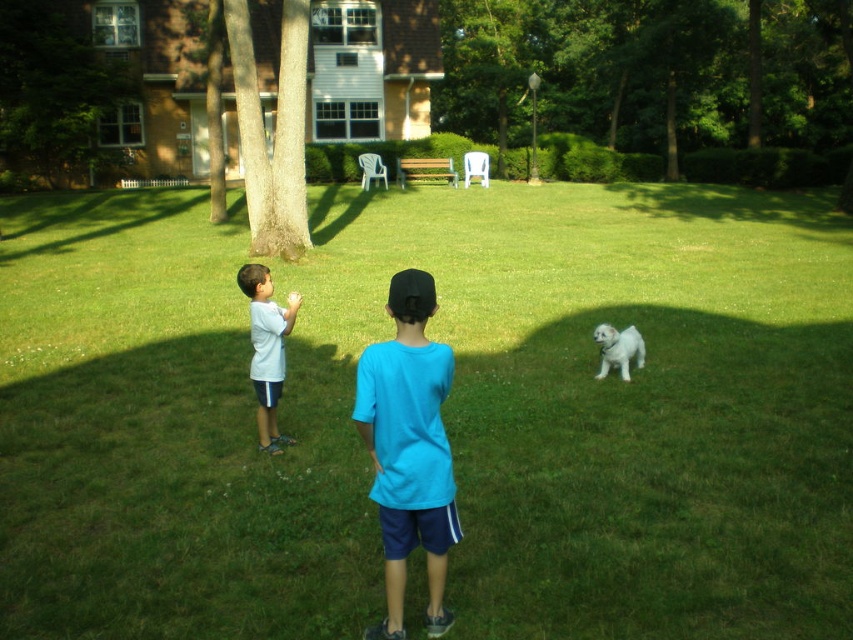
You are a photographer trying to capture a photo of the green leafy tree at upper center and the white fluffy dog at lower right. Since the tree is much taller than the dog, how might you position your camera to ensure both subjects are in focus and properly framed?

Since the green leafy tree at upper center is much taller than the white fluffy dog at lower right, you should position your camera so that the tree occupies the upper portion of the frame while the dog is placed at the lower right corner. This arrangement will allow both subjects to be in focus and properly framed within the composition.

You are planning to set up a small tent for a family picnic in the backyard shown. The tent requires a flat area larger than the white fluffy dog at lower right. Based on the scene, is there enough space on the green grass at center to accommodate the tent?

The green grass at center is bigger than the white fluffy dog at lower right, so yes, there is enough space on the green grass at center to accommodate the tent since it is larger than the dog.

You are a photographer trying to capture the children in the scene. If you want to focus on the blue cotton shirt at center, where should you aim your camera?

The blue cotton shirt at center is located at coordinates point (x=408, y=449), so aim your camera at that position to focus on it.